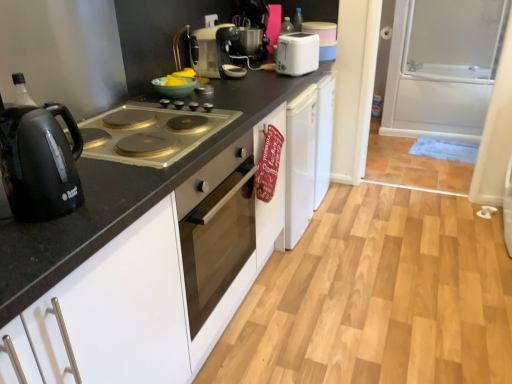
Question: Does matte silver toaster at upper center, marked as the 2th kitchen appliance in a left-to-right arrangement, turn towards black matte countertop at center?

Choices:
 (A) no
 (B) yes

Answer: (A)

Question: Can you confirm if matte silver toaster at upper center, the second kitchen appliance positioned from the bottom, is smaller than black matte countertop at center?

Choices:
 (A) no
 (B) yes

Answer: (B)

Question: From a real-world perspective, is matte silver toaster at upper center, the second kitchen appliance positioned from the bottom, positioned under black matte countertop at center based on gravity?

Choices:
 (A) no
 (B) yes

Answer: (A)

Question: Is matte silver toaster at upper center, the second kitchen appliance in the top-to-bottom sequence, located outside black matte countertop at center?

Choices:
 (A) yes
 (B) no

Answer: (A)

Question: From a real-world perspective, is matte silver toaster at upper center, positioned as the 2th kitchen appliance in back-to-front order, positioned over black matte countertop at center based on gravity?

Choices:
 (A) no
 (B) yes

Answer: (B)

Question: Would you say black matte countertop at center is to the left or to the right of matte silver gas stove at left in the picture?

Choices:
 (A) right
 (B) left

Answer: (A)

Question: Is point (159, 377) positioned closer to the camera than point (98, 152)?

Choices:
 (A) closer
 (B) farther

Answer: (B)

Question: Is black matte countertop at center spatially inside matte silver gas stove at left, or outside of it?

Choices:
 (A) inside
 (B) outside

Answer: (B)

Question: Looking at their shapes, would you say black matte countertop at center is wider or thinner than matte silver gas stove at left?

Choices:
 (A) thin
 (B) wide

Answer: (B)

Question: Is matte silver gas stove at left inside the boundaries of matte silver toaster at upper center, which ranks as the 2th kitchen appliance in right-to-left order, or outside?

Choices:
 (A) outside
 (B) inside

Answer: (A)

Question: Considering the positions of matte silver gas stove at left and matte silver toaster at upper center, marked as the 2th kitchen appliance in a left-to-right arrangement, in the image, is matte silver gas stove at left wider or thinner than matte silver toaster at upper center, marked as the 2th kitchen appliance in a left-to-right arrangement,?

Choices:
 (A) wide
 (B) thin

Answer: (A)

Question: Is point (115, 117) closer or farther from the camera than point (218, 34)?

Choices:
 (A) farther
 (B) closer

Answer: (B)

Question: Is matte silver gas stove at left bigger or smaller than matte silver toaster at upper center, marked as the 2th kitchen appliance in a left-to-right arrangement?

Choices:
 (A) big
 (B) small

Answer: (A)

Question: From their relative heights in the image, would you say transparent glass screen door at right is taller or shorter than black matte countertop at center?

Choices:
 (A) tall
 (B) short

Answer: (A)

Question: Is point (404, 112) positioned closer to the camera than point (280, 187)?

Choices:
 (A) farther
 (B) closer

Answer: (A)